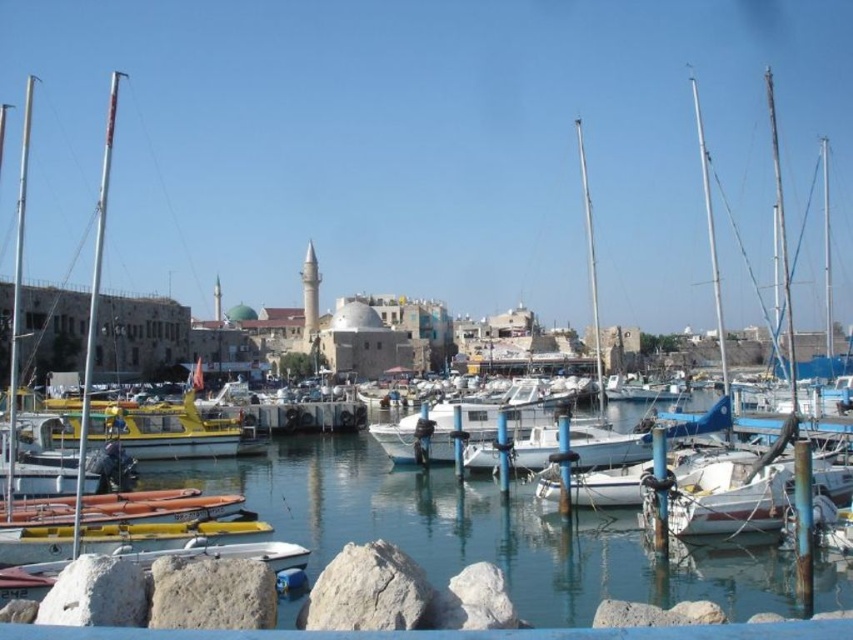
Question: Does rough textured rock at lower center appear under gray rough stone at lower left?

Choices:
 (A) yes
 (B) no

Answer: (A)

Question: Does rough textured rock at lower center have a larger size compared to yellow matte boat at center?

Choices:
 (A) no
 (B) yes

Answer: (A)

Question: Which is nearer to the clear blue water at center?

Choices:
 (A) yellow matte boat at center
 (B) rough textured rock at lower center
 (C) gray rough rock at lower left

Answer: (A)

Question: Which of these objects is positioned farthest from the yellow matte boat at center?

Choices:
 (A) white rough rock at center
 (B) rough textured rock at lower center
 (C) clear blue water at center

Answer: (B)

Question: Which of these objects is positioned farthest from the gray rough stone at lower left?

Choices:
 (A) clear blue water at center
 (B) gray rough rock at lower left

Answer: (A)

Question: Does gray rough stone at lower left appear on the right side of gray rough rock at lower left?

Choices:
 (A) no
 (B) yes

Answer: (B)